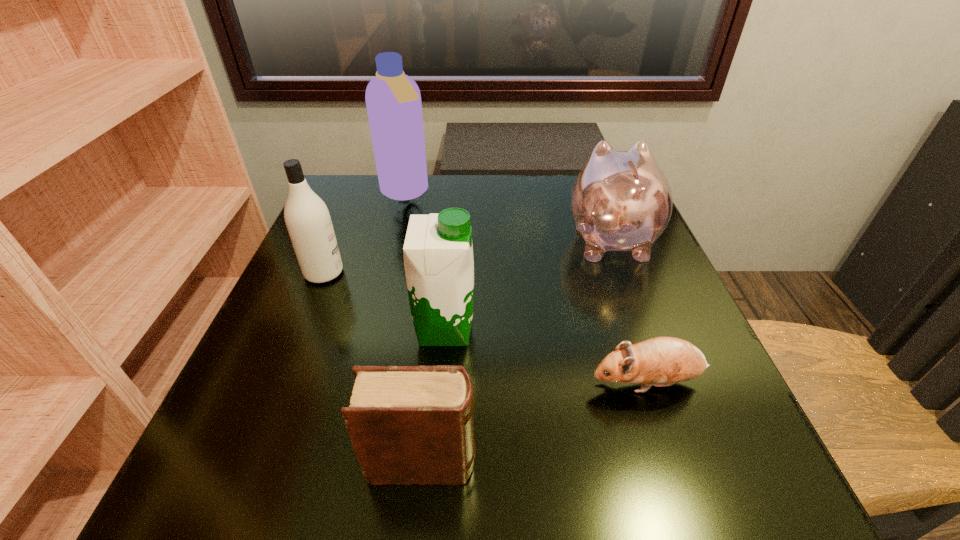
This screenshot has height=540, width=960. In order to click on vacant space located 0.390m on the front of the taller shampoo in this screenshot , I will do `click(372, 326)`.

This screenshot has width=960, height=540. Identify the location of vacant point located on the front-facing side of the left shampoo. (533, 273).

The height and width of the screenshot is (540, 960). What are the coordinates of `vacant region located 0.220m on the front-facing side of the third nearest object` in the screenshot? It's located at (597, 328).

Find the location of a particular element. Image resolution: width=960 pixels, height=540 pixels. free spot located on the front facing side of the piggy bank is located at coordinates (587, 177).

Identify the location of vacant region located 0.180m on the front facing side of the piggy bank. Image resolution: width=960 pixels, height=540 pixels. (587, 176).

Where is `free space located 0.180m on the front facing side of the piggy bank`? free space located 0.180m on the front facing side of the piggy bank is located at coordinates (587, 176).

Image resolution: width=960 pixels, height=540 pixels. Identify the location of vacant space located on the spine side of the nearest object. (608, 463).

At what (x,y) coordinates should I click in order to perform the action: click on free region located 0.090m at the face of the hamster. Please return your answer as a coordinate pair (x, y). This screenshot has width=960, height=540. Looking at the image, I should click on (532, 383).

Find the location of `vacant space located at the face of the hamster`. vacant space located at the face of the hamster is located at coordinates (438, 383).

In order to click on free region located 0.340m at the face of the hamster in this screenshot , I will do `click(375, 383)`.